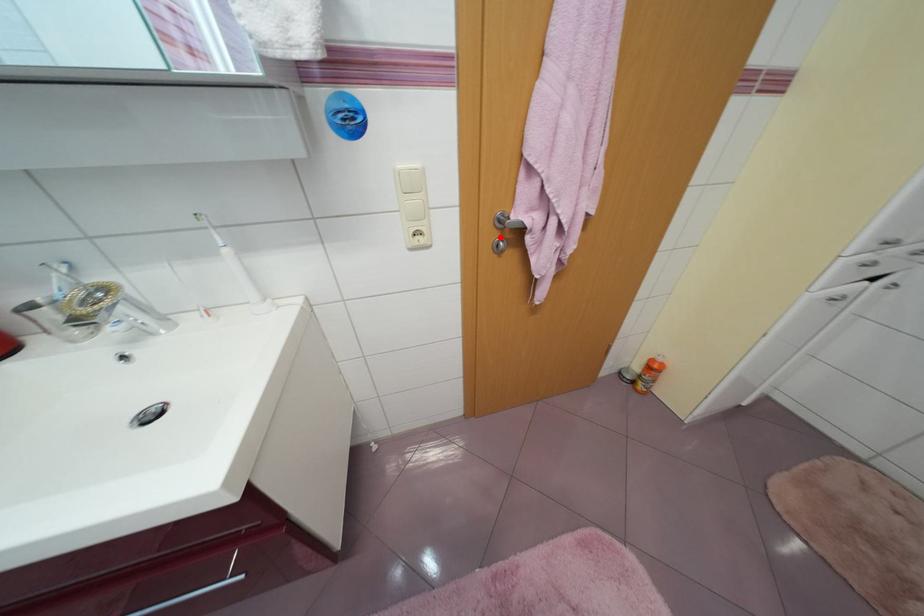
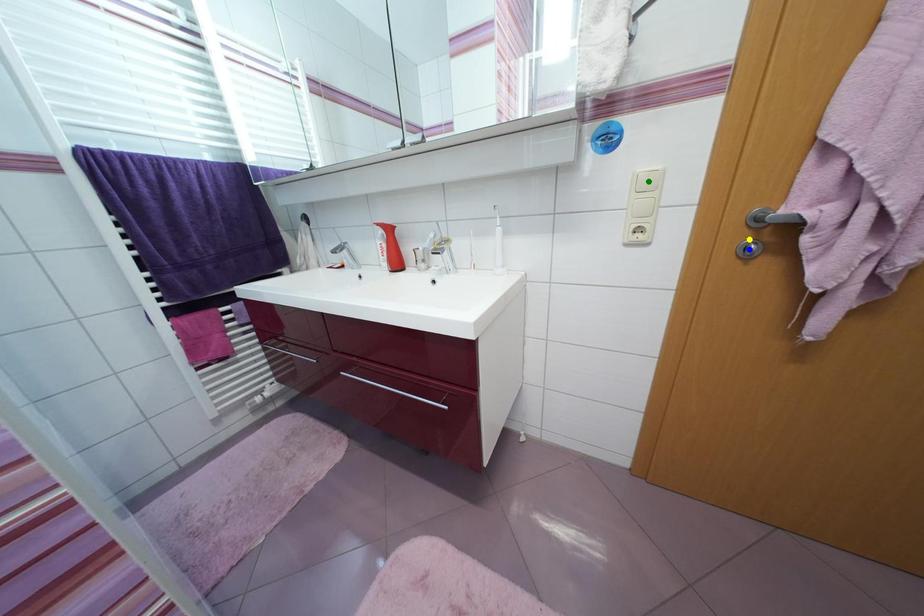
Question: I am providing you with two images of the same scene from different viewpoints. A red point is marked on the first image. You are given multiple points on the second image. Which point in image 2 is actually the same real-world point as the red point in image 1?

Choices:
 (A) green point
 (B) blue point
 (C) yellow point

Answer: (C)